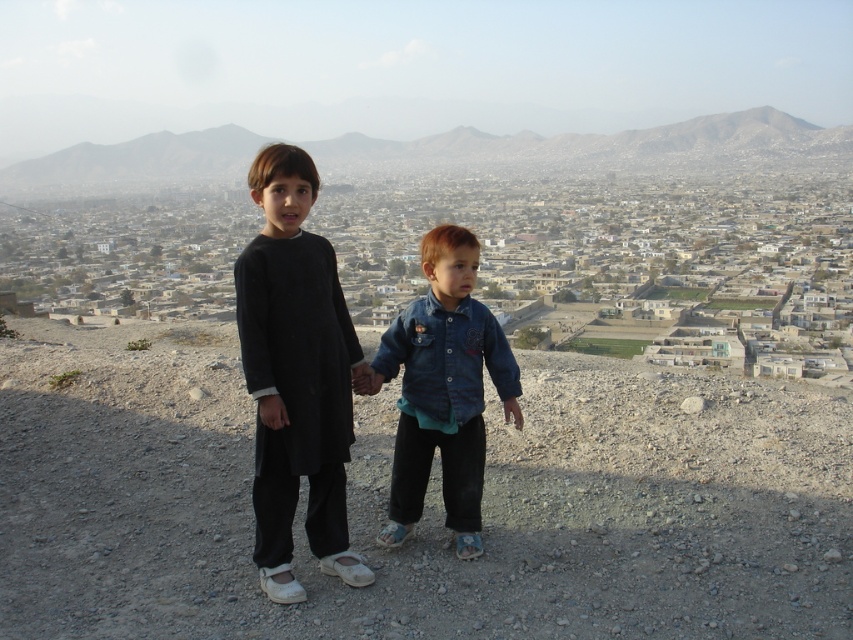
Consider the image. You are a photographer planning to capture a wide shot of the scene. Given that the black cotton kurta at center and the gray rocky hill at center are both in the frame, which object would require more space horizontally to ensure it is fully visible?

The gray rocky hill at center requires more horizontal space because its width is greater than the black cotton kurta at center.

You are a photographer trying to capture both the black cotton kurta at center and the denim jacket at center in a single shot. Based on their positions, which one will appear closer to the camera in the photo?

The black cotton kurta at center will appear closer to the camera because it is positioned in front of the denim jacket at center.